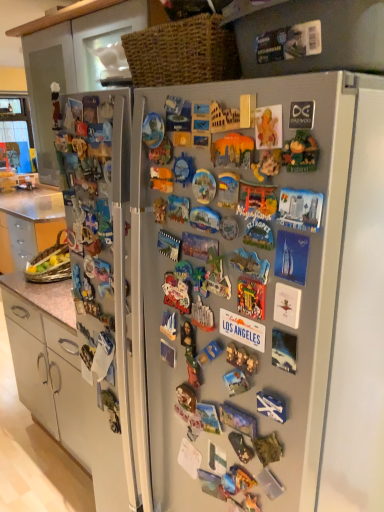
Where is `matte brown figurine at upper left, which is the tenth toy in right-to-left order`? The height and width of the screenshot is (512, 384). matte brown figurine at upper left, which is the tenth toy in right-to-left order is located at coordinates (55, 103).

How much space does wooden irish flag at right, positioned as the first toy in right-to-left order, occupy horizontally?

wooden irish flag at right, positioned as the first toy in right-to-left order, is 0.58 inches wide.

What do you see at coordinates (202, 316) in the screenshot? The width and height of the screenshot is (384, 512). I see `white plastic toy at center, the 8th toy when ordered from right to left` at bounding box center [202, 316].

I want to click on matte plastic magnet at center, the 5th toy viewed from the left, so click(233, 150).

Describe the element at coordinates (228, 190) in the screenshot. This screenshot has width=384, height=512. I see `metallic silver toy at center, the 7th toy in the right-to-left sequence` at that location.

What are the coordinates of `matte plastic cards at center, the second toy when ordered from left to right` in the screenshot? It's located at (177, 293).

I want to click on matte brown figurine at upper left, the first toy viewed from the left, so click(55, 103).

From the picture: Which object is further away from the camera taking this photo, matte plastic cards at center, acting as the 9th toy starting from the right, or matte plastic magnet at center, which is the third toy from right to left?

matte plastic cards at center, acting as the 9th toy starting from the right, is more distant.

From a real-world perspective, who is located lower, matte plastic cards at center, the second toy when ordered from left to right, or matte plastic magnet at center, which is the 8th toy in left-to-right order?

In real-world perspective, matte plastic cards at center, the second toy when ordered from left to right, is lower.

From the image's perspective, is matte plastic cards at center, acting as the 9th toy starting from the right, located above or below matte plastic magnet at center, which is the 8th toy in left-to-right order?

Clearly, from the image's perspective, matte plastic cards at center, acting as the 9th toy starting from the right, is below matte plastic magnet at center, which is the 8th toy in left-to-right order.

The image size is (384, 512). Identify the location of toy that is the 1st object directly below the matte plastic magnet at center, which is the third toy from right to left (from a real-world perspective). (177, 293).

Starting from the satin silver fridge at center, which toy is the 3rd one to the right? Please provide its 2D coordinates.

[(228, 190)]

From the image's perspective, is metallic silver toy at center, the 7th toy in the right-to-left sequence, above or below satin silver fridge at center?

From the image's perspective, metallic silver toy at center, the 7th toy in the right-to-left sequence, appears above satin silver fridge at center.

From a real-world perspective, which is physically below, metallic silver toy at center, which is the fourth toy from left to right, or satin silver fridge at center?

satin silver fridge at center, from a real-world perspective.

Considering the sizes of objects metallic silver toy at center, the 7th toy in the right-to-left sequence, and satin silver fridge at center in the image provided, who is thinner, metallic silver toy at center, the 7th toy in the right-to-left sequence, or satin silver fridge at center?

metallic silver toy at center, the 7th toy in the right-to-left sequence, is thinner.

Identify the location of toy that is the 4th one when counting backward from the multicolored plastic toy at center, the 4th toy in the right-to-left sequence. The image size is (384, 512). (251, 298).

Considering the positions of objects matte plastic magnet at center, which is the third toy from right to left, and multicolored plastic toy at center, which is counted as the seventh toy, starting from the left, in the image provided, who is more to the left, matte plastic magnet at center, which is the third toy from right to left, or multicolored plastic toy at center, which is counted as the seventh toy, starting from the left,?

multicolored plastic toy at center, which is counted as the seventh toy, starting from the left, is more to the left.

Is point (240, 296) closer or farther from the camera than point (253, 208)?

Point (240, 296).

Is matte plastic magnet at center, which is the third toy from right to left, positioned far away from multicolored plastic toy at center, the 4th toy in the right-to-left sequence?

matte plastic magnet at center, which is the third toy from right to left, is actually quite close to multicolored plastic toy at center, the 4th toy in the right-to-left sequence.

In terms of width, does matte plastic cards at center, the second toy when ordered from left to right, look wider or thinner when compared to wooden puzzle piece at center, which appears as the second toy when viewed from the right?

matte plastic cards at center, the second toy when ordered from left to right, is wider than wooden puzzle piece at center, which appears as the second toy when viewed from the right.

Looking at this image, is matte plastic cards at center, the second toy when ordered from left to right, facing away from wooden puzzle piece at center, which appears as the second toy when viewed from the right?

That's not correct — matte plastic cards at center, the second toy when ordered from left to right, is not looking away from wooden puzzle piece at center, which appears as the second toy when viewed from the right.

Which of these two, matte plastic cards at center, the second toy when ordered from left to right, or wooden puzzle piece at center, which appears as the second toy when viewed from the right, stands shorter?

wooden puzzle piece at center, which appears as the second toy when viewed from the right, is shorter.

Between point (162, 288) and point (275, 144), which one is positioned in front?

Positioned in front is point (275, 144).

Is metallic silver toy at center, placed as the 5th toy when sorted from right to left, facing towards matte brown figurine at upper left, which is the tenth toy in right-to-left order?

No.

From a real-world perspective, which is physically below, metallic silver toy at center, placed as the 5th toy when sorted from right to left, or matte brown figurine at upper left, the first toy viewed from the left?

In real-world perspective, metallic silver toy at center, placed as the 5th toy when sorted from right to left, is lower.

Can you confirm if metallic silver toy at center, which ranks as the 6th toy in left-to-right order, is shorter than matte brown figurine at upper left, which is the tenth toy in right-to-left order?

Correct, metallic silver toy at center, which ranks as the 6th toy in left-to-right order, is not as tall as matte brown figurine at upper left, which is the tenth toy in right-to-left order.

Considering the positions of objects metallic silver toy at center, which ranks as the 6th toy in left-to-right order, and matte brown figurine at upper left, which is the tenth toy in right-to-left order, in the image provided, who is more to the right, metallic silver toy at center, which ranks as the 6th toy in left-to-right order, or matte brown figurine at upper left, which is the tenth toy in right-to-left order,?

Positioned to the right is metallic silver toy at center, which ranks as the 6th toy in left-to-right order.

From the image's perspective, is metallic silver toy at center, which ranks as the 6th toy in left-to-right order, under metallic silver toy at center, the 7th toy in the right-to-left sequence?

Yes, from the image's perspective, metallic silver toy at center, which ranks as the 6th toy in left-to-right order, is below metallic silver toy at center, the 7th toy in the right-to-left sequence.

From a real-world perspective, is metallic silver toy at center, placed as the 5th toy when sorted from right to left, physically below metallic silver toy at center, which is the fourth toy from left to right?

Yes.

Considering the relative sizes of metallic silver toy at center, which ranks as the 6th toy in left-to-right order, and metallic silver toy at center, the 7th toy in the right-to-left sequence, in the image provided, is metallic silver toy at center, which ranks as the 6th toy in left-to-right order, taller than metallic silver toy at center, the 7th toy in the right-to-left sequence,?

→ No, metallic silver toy at center, which ranks as the 6th toy in left-to-right order, is not taller than metallic silver toy at center, the 7th toy in the right-to-left sequence.

From a real-world perspective, which is physically below, wooden puzzle piece at center, positioned as the ninth toy in left-to-right order, or satin silver fridge at center?

In real-world perspective, satin silver fridge at center is lower.

Can you confirm if wooden puzzle piece at center, positioned as the ninth toy in left-to-right order, is smaller than satin silver fridge at center?

Indeed, wooden puzzle piece at center, positioned as the ninth toy in left-to-right order, has a smaller size compared to satin silver fridge at center.

Considering the sizes of objects wooden puzzle piece at center, positioned as the ninth toy in left-to-right order, and satin silver fridge at center in the image provided, who is shorter, wooden puzzle piece at center, positioned as the ninth toy in left-to-right order, or satin silver fridge at center?

With less height is wooden puzzle piece at center, positioned as the ninth toy in left-to-right order.

This screenshot has height=512, width=384. Identify the location of toy that is the 8th object located above the satin silver fridge at center (from the image's perspective). (268, 127).

You are a GUI agent. You are given a task and a screenshot of the screen. Output one action in this format:
    pyautogui.click(x=<x>, y=<y>)
    Task: Click on the toy that is the 1st one below the matte plastic magnet at center, which is the 8th toy in left-to-right order (from a real-world perspective)
    
    Given the screenshot: What is the action you would take?
    pyautogui.click(x=177, y=293)

Locate an element on the screen. This screenshot has width=384, height=512. refrigerator below the metallic silver toy at center, the 7th toy in the right-to-left sequence (from the image's perspective) is located at coordinates (265, 304).

Based on the photo, based on their spatial positions, is matte brown figurine at upper left, which is the tenth toy in right-to-left order, or wooden irish flag at right, the 10th toy positioned from the left, closer to metallic silver toy at center, which ranks as the 6th toy in left-to-right order?

wooden irish flag at right, the 10th toy positioned from the left, is closer to metallic silver toy at center, which ranks as the 6th toy in left-to-right order.

Consider the image. Based on their spatial positions, is satin silver fridge at center or white plastic toy at center, positioned as the 3th toy in left-to-right order, closer to multicolored plastic toy at center, the 4th toy in the right-to-left sequence?

Among the two, white plastic toy at center, positioned as the 3th toy in left-to-right order, is located nearer to multicolored plastic toy at center, the 4th toy in the right-to-left sequence.

Which object lies nearer to the anchor point metallic silver toy at center, which is the fourth toy from left to right, wooden puzzle piece at center, positioned as the ninth toy in left-to-right order, or metallic silver toy at center, which ranks as the 6th toy in left-to-right order?

The object closer to metallic silver toy at center, which is the fourth toy from left to right, is wooden puzzle piece at center, positioned as the ninth toy in left-to-right order.

When comparing their distances from metallic silver toy at center, placed as the 5th toy when sorted from right to left, does satin silver fridge at center or matte plastic magnet at center, the 5th toy viewed from the left, seem further?

The object further to metallic silver toy at center, placed as the 5th toy when sorted from right to left, is satin silver fridge at center.

Looking at the image, which one is located further to metallic silver toy at center, placed as the 5th toy when sorted from right to left, matte brown figurine at upper left, the first toy viewed from the left, or wooden puzzle piece at center, positioned as the ninth toy in left-to-right order?

matte brown figurine at upper left, the first toy viewed from the left.

Which object lies nearer to the anchor point matte plastic magnet at center, which is the third toy from right to left, metallic silver toy at center, the 7th toy in the right-to-left sequence, or matte plastic magnet at center, the 5th toy viewed from the left?

metallic silver toy at center, the 7th toy in the right-to-left sequence, is positioned closer to the anchor matte plastic magnet at center, which is the third toy from right to left.

Considering their positions, is wooden irish flag at right, positioned as the first toy in right-to-left order, positioned further to matte brown figurine at upper left, the first toy viewed from the left, than satin silver fridge at center?

The object further to matte brown figurine at upper left, the first toy viewed from the left, is satin silver fridge at center.

Looking at the image, which one is located further to matte brown figurine at upper left, which is the tenth toy in right-to-left order, wooden puzzle piece at center, which appears as the second toy when viewed from the right, or satin silver fridge at center?

satin silver fridge at center.

At what (x,y) coordinates should I click in order to perform the action: click on refrigerator between matte brown figurine at upper left, which is the tenth toy in right-to-left order, and white plastic toy at center, the 8th toy when ordered from right to left, vertically. Please return your answer as a coordinate pair (x, y). Looking at the image, I should click on (265, 304).

Identify the location of toy positioned between white plastic toy at center, the 8th toy when ordered from right to left, and satin silver fridge at center from near to far. This screenshot has height=512, width=384. (177, 293).

Where is `refrigerator between matte brown figurine at upper left, the first toy viewed from the left, and wooden irish flag at right, positioned as the first toy in right-to-left order, in the horizontal direction`? This screenshot has width=384, height=512. refrigerator between matte brown figurine at upper left, the first toy viewed from the left, and wooden irish flag at right, positioned as the first toy in right-to-left order, in the horizontal direction is located at coordinates (265, 304).

Find the location of a particular element. toy between multicolored plastic toy at center, which is counted as the seventh toy, starting from the left, and matte plastic magnet at center, which is the third toy from right to left, vertically is located at coordinates (250, 265).